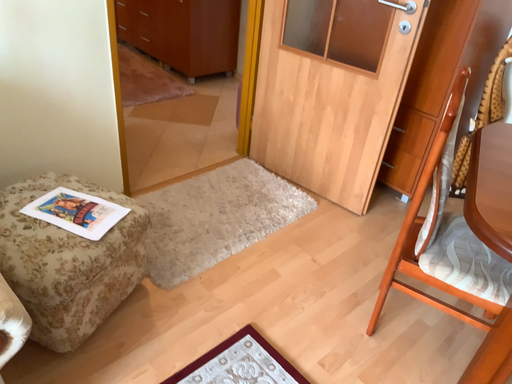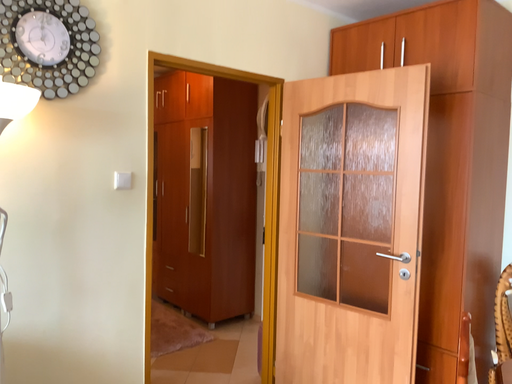
Question: Which way did the camera rotate in the video?

Choices:
 (A) rotated upward
 (B) rotated downward

Answer: (A)